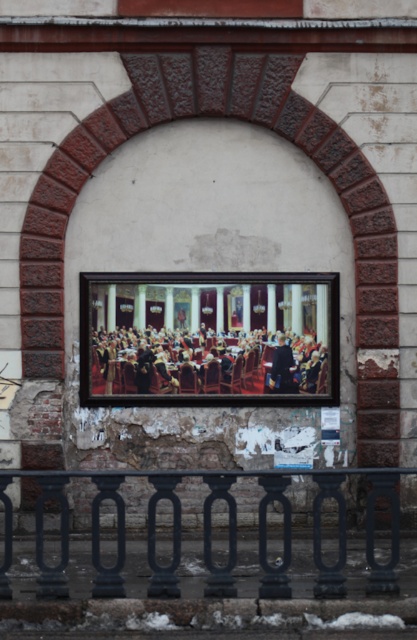
You are standing in front of the building facade and want to take a photo of the dark blue suit at center without including the smooth black railing at lower center. Where should you position yourself to achieve this?

Position yourself higher so that the smooth black railing at lower center is out of the frame while capturing the dark blue suit at center.

You are standing in front of the building facade and want to touch the smooth black railing at lower center. Based on its coordinates, where should you look to find it?

The smooth black railing at lower center is located at point coordinates of (x=208, y=531).

Based on the photo, you are standing in front of the building facade and notice the smooth black railing at lower center and the formal attire person at center. Which object is taller?

The smooth black railing at lower center is much taller than the formal attire person at center.